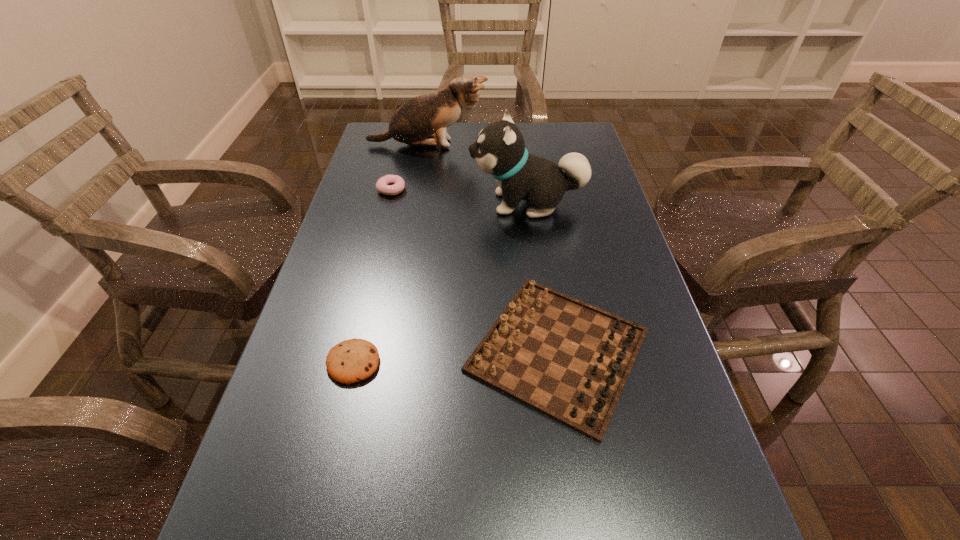
Locate an element on the screen. The height and width of the screenshot is (540, 960). vacant space that satisfies the following two spatial constraints: 1. on the front side of the doughnut; 2. on the left side of the third shortest object is located at coordinates (350, 350).

Locate an element on the screen. vacant space that satisfies the following two spatial constraints: 1. at the face of the chessboard; 2. on the left side of the puppy is located at coordinates (546, 350).

Where is `vacant space that satisfies the following two spatial constraints: 1. on the front side of the doughnut; 2. on the left side of the third tallest object`? vacant space that satisfies the following two spatial constraints: 1. on the front side of the doughnut; 2. on the left side of the third tallest object is located at coordinates (350, 350).